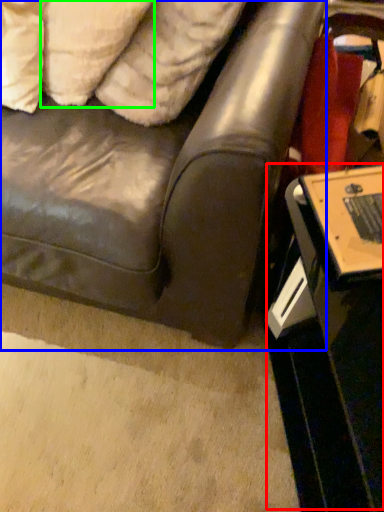
Question: Considering the real-world distances, which object is closest to table (highlighted by a red box)? studio couch (highlighted by a blue box) or pillow (highlighted by a green box).

Choices:
 (A) studio couch
 (B) pillow

Answer: (A)